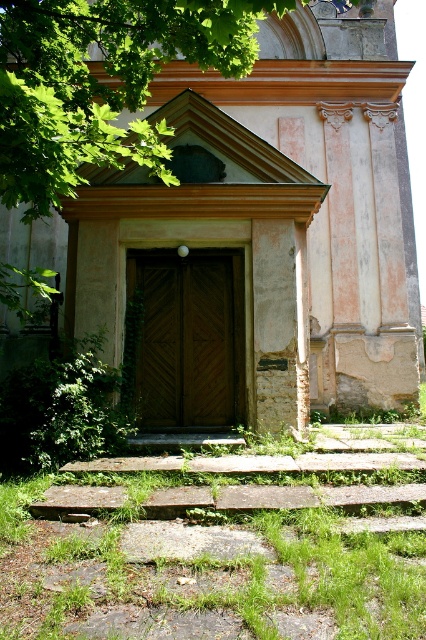
You are standing in front of the old church entrance. You notice a green leafy tree at upper left and a brown wooden door at center. Which object is taller?

The brown wooden door at center is taller than the green leafy tree at upper left.